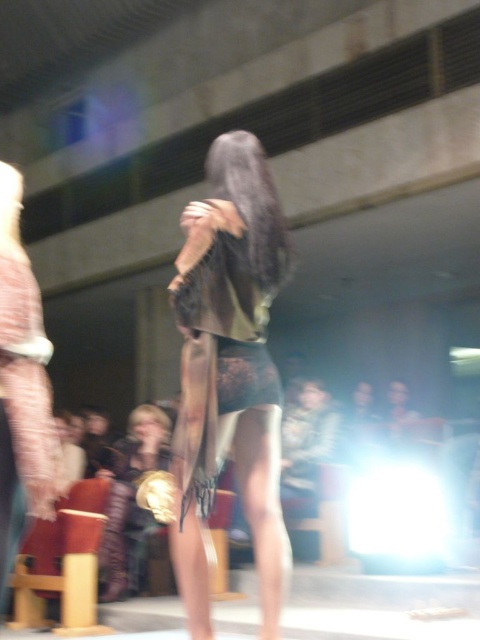
This screenshot has height=640, width=480. What do you see at coordinates (229, 369) in the screenshot?
I see `shiny metallic dress at center` at bounding box center [229, 369].

The width and height of the screenshot is (480, 640). Find the location of `shiny metallic dress at center`. shiny metallic dress at center is located at coordinates (229, 369).

Where is `shiny metallic dress at center`? The image size is (480, 640). shiny metallic dress at center is located at coordinates (229, 369).

Is shiny metallic dress at center positioned before satin black dress at center?

No, shiny metallic dress at center is further to the viewer.

This screenshot has height=640, width=480. I want to click on shiny metallic dress at center, so click(x=229, y=369).

How distant is satin black dress at center from shiny gold dress at center?

A distance of 10.03 feet exists between satin black dress at center and shiny gold dress at center.

Between satin black dress at center and shiny gold dress at center, which one has less height?

With less height is shiny gold dress at center.

Which is in front, point (35, 400) or point (113, 550)?

Point (35, 400) is more forward.

The height and width of the screenshot is (640, 480). I want to click on satin black dress at center, so click(x=22, y=387).